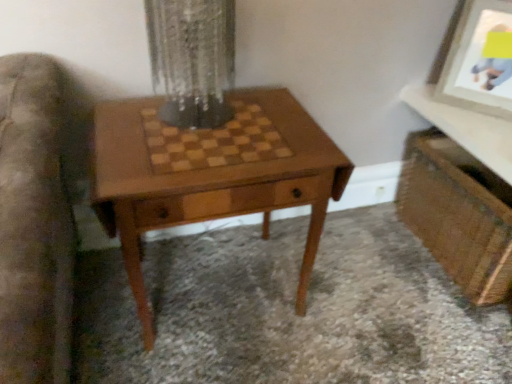
Question: From a real-world perspective, is clear glass vase at center above or below wooden chessboard at upper right?

Choices:
 (A) above
 (B) below

Answer: (A)

Question: Visually, is clear glass vase at center positioned to the left or to the right of wooden chessboard at upper right?

Choices:
 (A) left
 (B) right

Answer: (A)

Question: Which object is positioned farthest from the clear glass vase at center?

Choices:
 (A) matte white picture frame at upper right
 (B) wooden vanity at lower right
 (C) wooden chessboard at upper right
 (D) wooden chess table at center

Answer: (A)

Question: Which object is the closest to the clear glass vase at center?

Choices:
 (A) matte white picture frame at upper right
 (B) wooden chessboard at upper right
 (C) wooden vanity at lower right
 (D) wooden chess table at center

Answer: (D)